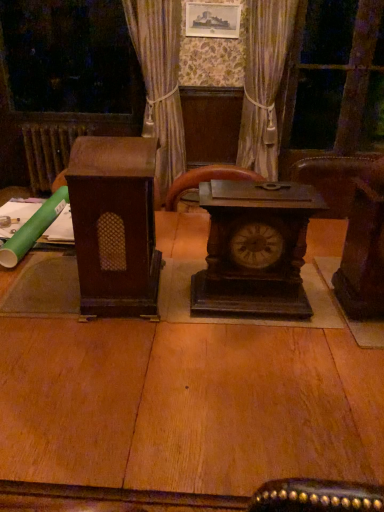
Question: From a real-world perspective, is dark brown wood clock at center located higher than transparent glass door at upper right?

Choices:
 (A) yes
 (B) no

Answer: (B)

Question: Is dark brown wood clock at center far from transparent glass door at upper right?

Choices:
 (A) yes
 (B) no

Answer: (A)

Question: Is dark brown wood clock at center at the right side of transparent glass door at upper right?

Choices:
 (A) no
 (B) yes

Answer: (A)

Question: Is dark brown wood clock at center taller than transparent glass door at upper right?

Choices:
 (A) no
 (B) yes

Answer: (A)

Question: Can transparent glass door at upper right be found inside dark brown wood clock at center?

Choices:
 (A) no
 (B) yes

Answer: (A)

Question: From a real-world perspective, does dark brown wood clock at center sit lower than transparent glass door at upper right?

Choices:
 (A) no
 (B) yes

Answer: (B)

Question: Is brown wood speaker at left, which appears as the second furniture when viewed from the right, a part of silky beige curtain at center?

Choices:
 (A) yes
 (B) no

Answer: (B)

Question: Does silky beige curtain at center have a smaller size compared to brown wood speaker at left, which appears as the second furniture when viewed from the right?

Choices:
 (A) no
 (B) yes

Answer: (A)

Question: Is silky beige curtain at center turned away from brown wood speaker at left, which appears as the second furniture when viewed from the right?

Choices:
 (A) yes
 (B) no

Answer: (B)

Question: Does silky beige curtain at center have a larger size compared to brown wood speaker at left, the 1th furniture viewed from the left?

Choices:
 (A) yes
 (B) no

Answer: (A)

Question: Is silky beige curtain at center thinner than brown wood speaker at left, the 1th furniture viewed from the left?

Choices:
 (A) yes
 (B) no

Answer: (B)

Question: Is the depth of silky beige curtain at center less than that of brown wood speaker at left, the 1th furniture viewed from the left?

Choices:
 (A) yes
 (B) no

Answer: (B)

Question: Is the surface of brown wooden radiator at left in direct contact with dark wood chair at right, which is counted as the second furniture, starting from the left?

Choices:
 (A) yes
 (B) no

Answer: (B)